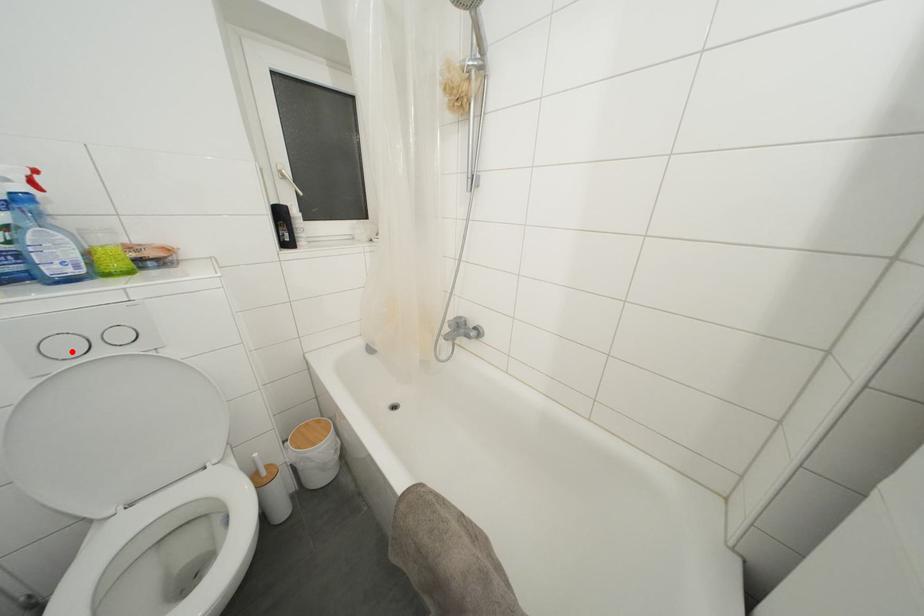
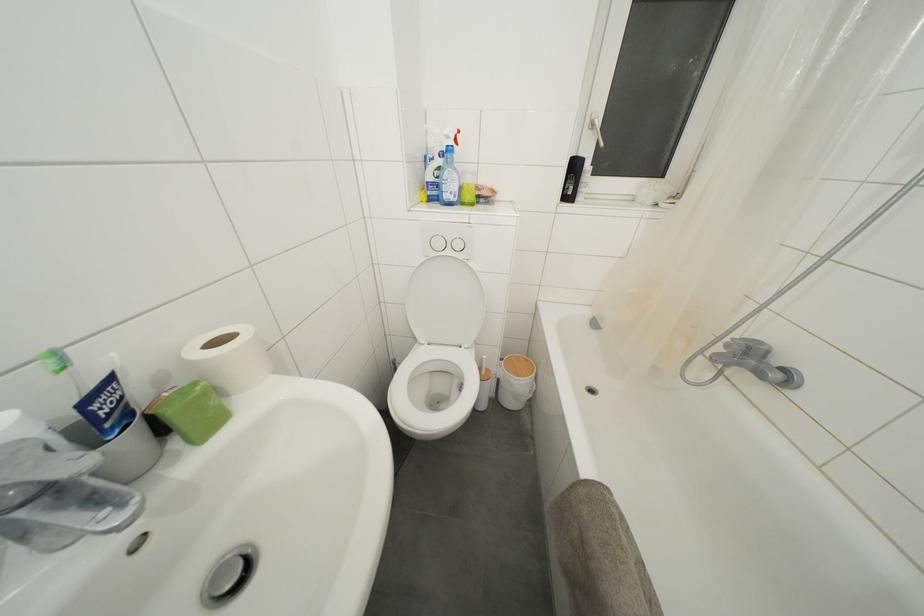
Question: I am providing you with two images of the same scene from different viewpoints. In image1, a red point is highlighted. Considering the same 3D point in image2, which of the following is correct?

Choices:
 (A) It is closer
 (B) It is farther

Answer: (A)